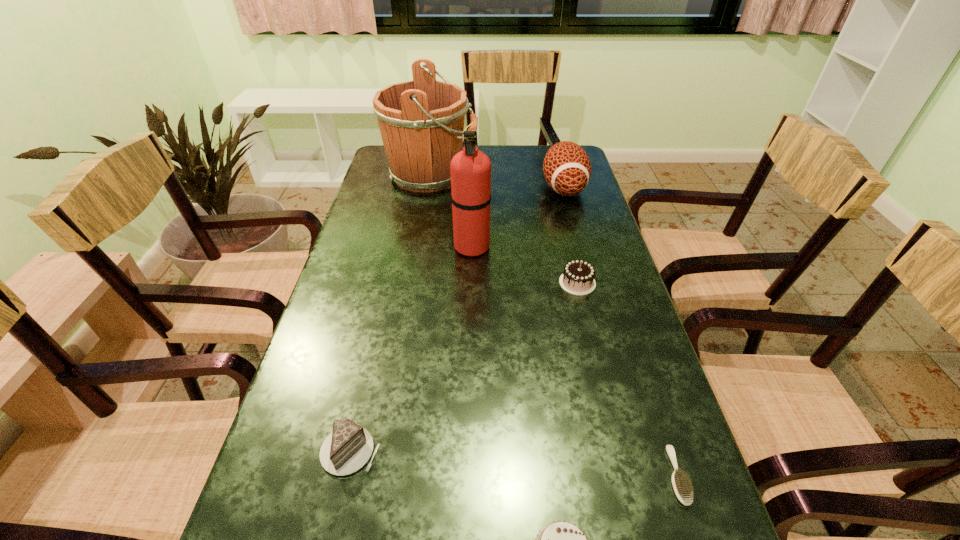
Where is `blank area located on the front of the football`? This screenshot has height=540, width=960. blank area located on the front of the football is located at coordinates (581, 251).

This screenshot has height=540, width=960. I want to click on free space located on the left of the rightmost chocolate cake, so click(513, 283).

The image size is (960, 540). What are the coordinates of `free space located 0.080m on the left of the second shortest chocolate cake` in the screenshot? It's located at (276, 451).

In order to click on vacant space located 0.270m on the left of the scrubbing brush in this screenshot , I will do `click(513, 475)`.

I want to click on bucket that is at the far edge, so click(x=419, y=121).

This screenshot has width=960, height=540. In order to click on football present at the far edge in this screenshot , I will do `click(567, 169)`.

You are a GUI agent. You are given a task and a screenshot of the screen. Output one action in this format:
    pyautogui.click(x=<x>, y=<y>)
    Task: Click on the bucket that is at the left edge
    This screenshot has width=960, height=540.
    Given the screenshot: What is the action you would take?
    click(419, 121)

Identify the location of chocolate cake that is at the left edge. (348, 448).

I want to click on football that is at the right edge, so click(x=567, y=169).

The width and height of the screenshot is (960, 540). I want to click on chocolate cake that is at the right edge, so click(x=578, y=276).